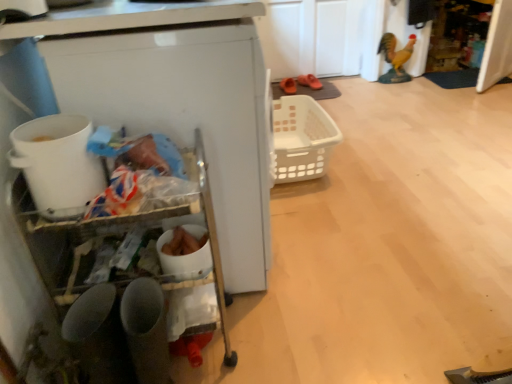
Image resolution: width=512 pixels, height=384 pixels. I want to click on space that is in front of white plastic basket at center, so point(338,220).